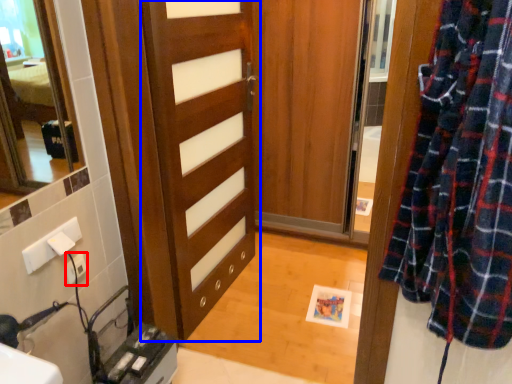
Question: Which of the following is the farthest to the observer, electric outlet (highlighted by a red box) or door (highlighted by a blue box)?

Choices:
 (A) electric outlet
 (B) door

Answer: (A)